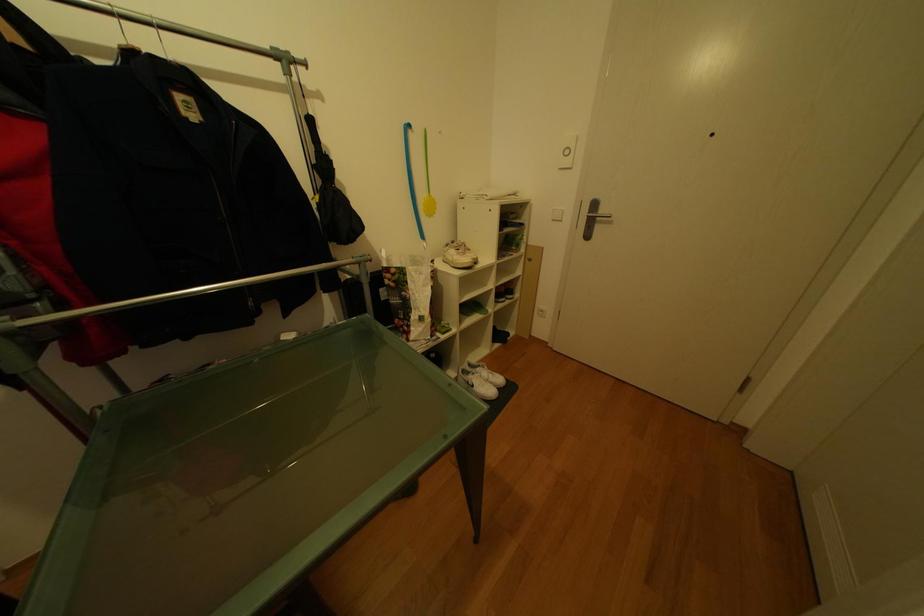
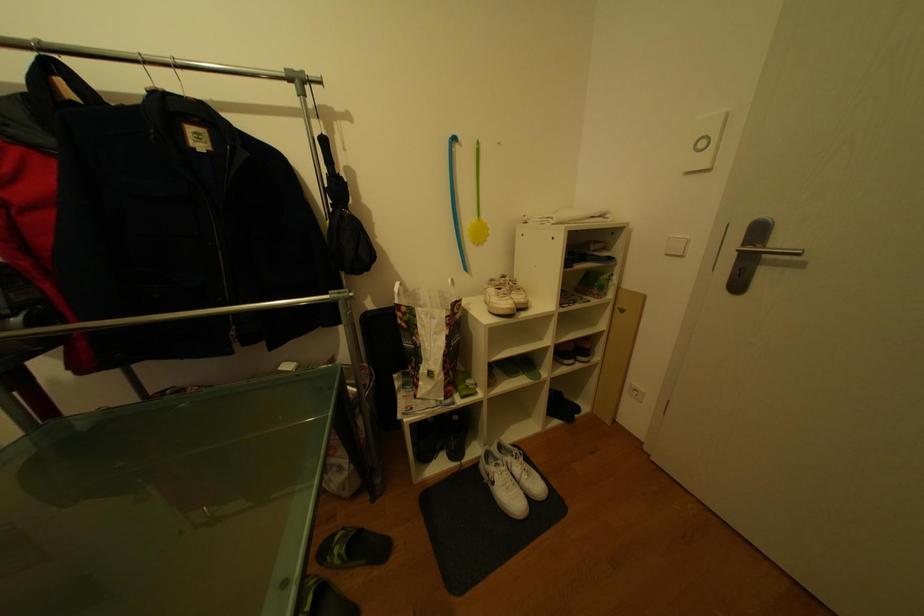
Question: The images are taken continuously from a first-person perspective. In which direction is your viewpoint rotating?

Choices:
 (A) Left
 (B) Right
 (C) Up
 (D) Down

Answer: (A)